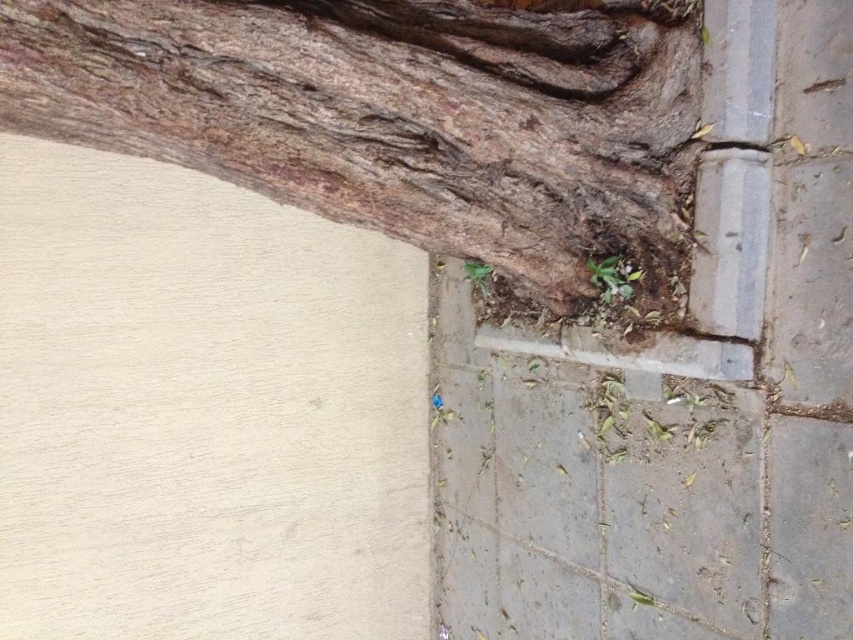
Can you confirm if green leafy weed at lower right is bigger than green leafy weed at lower center?

No.

Is point (621, 291) more distant than point (488, 282)?

That is False.

Is point (614, 289) more distant than point (479, 262)?

That is False.

The width and height of the screenshot is (853, 640). Identify the location of green leafy weed at lower right. (613, 276).

Measure the distance between point (258,70) and camera.

Point (258,70) is 4.19 feet away from camera.

Does brown rough bark at upper left have a larger size compared to green leafy weed at lower right?

Correct, brown rough bark at upper left is larger in size than green leafy weed at lower right.

Image resolution: width=853 pixels, height=640 pixels. I want to click on brown rough bark at upper left, so click(386, 113).

The height and width of the screenshot is (640, 853). I want to click on brown rough bark at upper left, so click(386, 113).

Is brown rough bark at upper left taller than green leafy weed at lower center?

Yes, brown rough bark at upper left is taller than green leafy weed at lower center.

Between brown rough bark at upper left and green leafy weed at lower center, which one is positioned lower?

green leafy weed at lower center is lower down.

The height and width of the screenshot is (640, 853). What are the coordinates of `brown rough bark at upper left` in the screenshot? It's located at (386, 113).

This screenshot has width=853, height=640. Identify the location of brown rough bark at upper left. (386, 113).